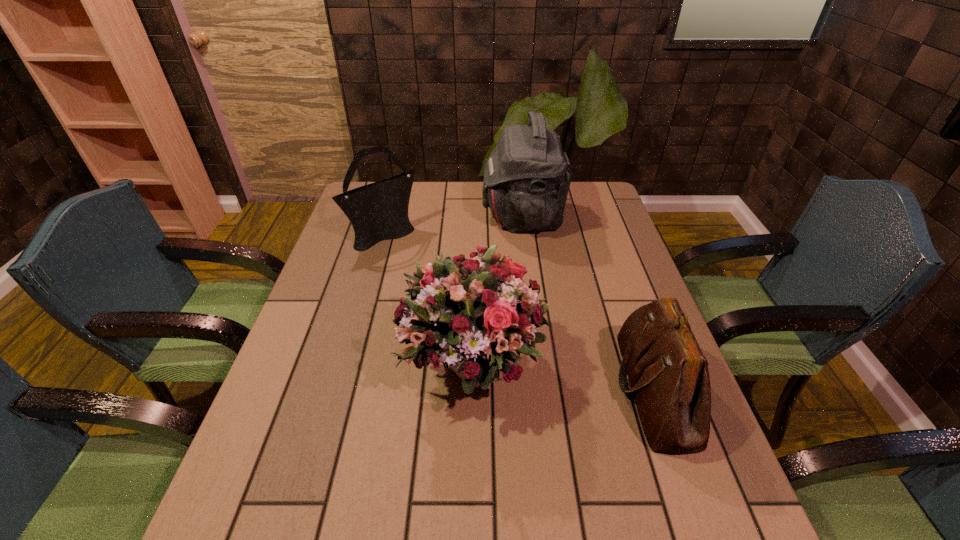
The image size is (960, 540). Identify the location of the second shoulder bag from left to right. (527, 177).

You are a GUI agent. You are given a task and a screenshot of the screen. Output one action in this format:
    pyautogui.click(x=<x>, y=<y>)
    Task: Click on the bouquet
    
    Given the screenshot: What is the action you would take?
    pyautogui.click(x=466, y=313)

You are a GUI agent. You are given a task and a screenshot of the screen. Output one action in this format:
    pyautogui.click(x=<x>, y=<y>)
    Task: Click on the leftmost object
    
    Given the screenshot: What is the action you would take?
    [378, 211]

Identify the location of the nearest shoulder bag. This screenshot has height=540, width=960. (668, 374).

The width and height of the screenshot is (960, 540). What are the coordinates of `the rightmost shoulder bag` in the screenshot? It's located at (668, 374).

What are the coordinates of `free space located 0.280m on the open flap of the second shoulder bag from right to left` in the screenshot? It's located at (399, 216).

At what (x,y) coordinates should I click in order to perform the action: click on free region located on the open flap of the second shoulder bag from right to left. Please return your answer as a coordinate pair (x, y). Image resolution: width=960 pixels, height=540 pixels. Looking at the image, I should click on (456, 216).

Where is `free region located 0.170m on the open flap of the second shoulder bag from right to left`? This screenshot has width=960, height=540. free region located 0.170m on the open flap of the second shoulder bag from right to left is located at coordinates (432, 216).

Where is `free space located 0.060m on the right of the bouquet`? This screenshot has width=960, height=540. free space located 0.060m on the right of the bouquet is located at coordinates (571, 366).

At what (x,y) coordinates should I click in order to perform the action: click on free space located on the right of the leftmost shoulder bag. Please return your answer as a coordinate pair (x, y). This screenshot has width=960, height=540. Looking at the image, I should click on (513, 234).